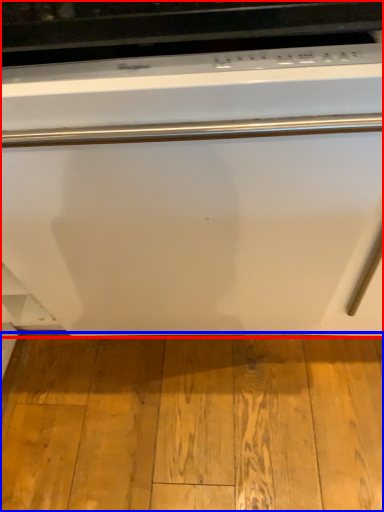
Question: Which object is further to the camera taking this photo, home appliance (highlighted by a red box) or hardwood (highlighted by a blue box)?

Choices:
 (A) home appliance
 (B) hardwood

Answer: (B)